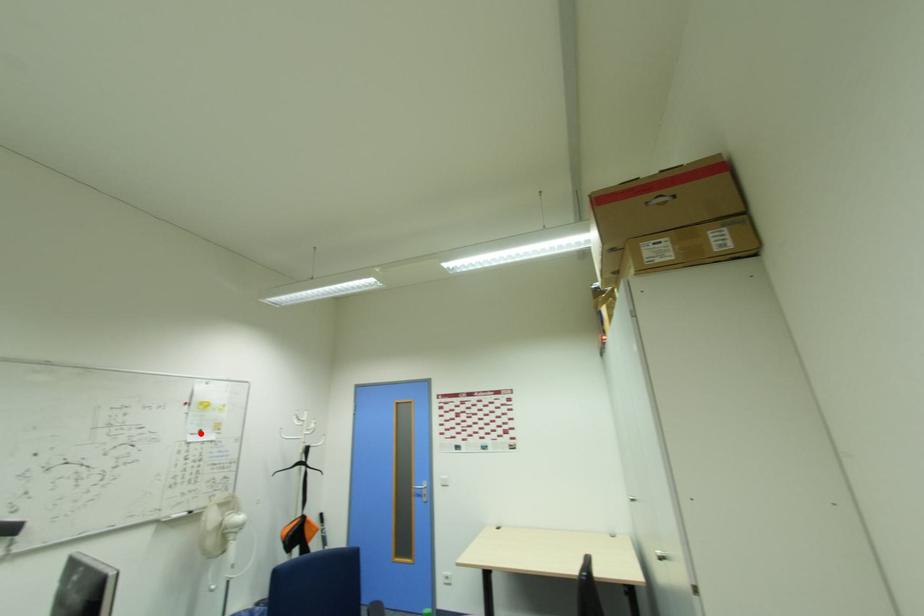
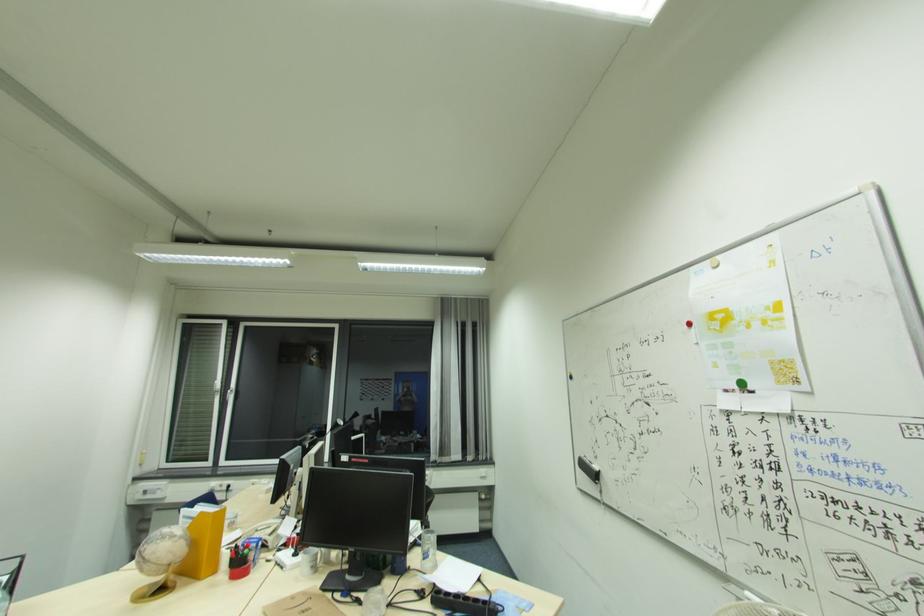
In the second image, find the point that corresponds to the highlighted location in the first image.

(739, 387)